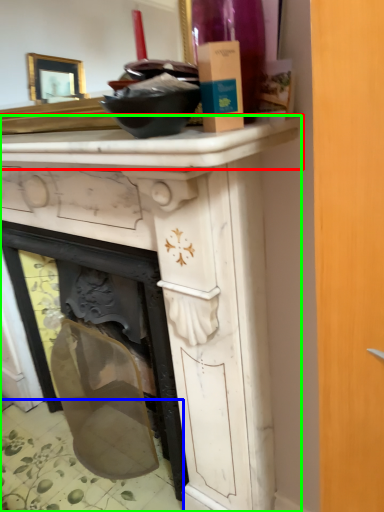
Question: Estimate the real-world distances between objects in this image. Which object is closer to counter top (highlighted by a red box), tile (highlighted by a blue box) or vanity (highlighted by a green box)?

Choices:
 (A) tile
 (B) vanity

Answer: (B)